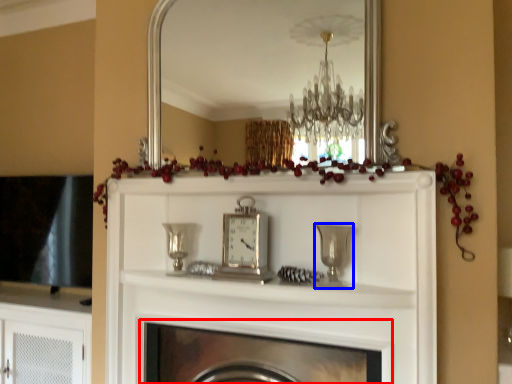
Question: Which of the following is the closest to the observer, fireplace (highlighted by a red box) or candle holder (highlighted by a blue box)?

Choices:
 (A) fireplace
 (B) candle holder

Answer: (A)